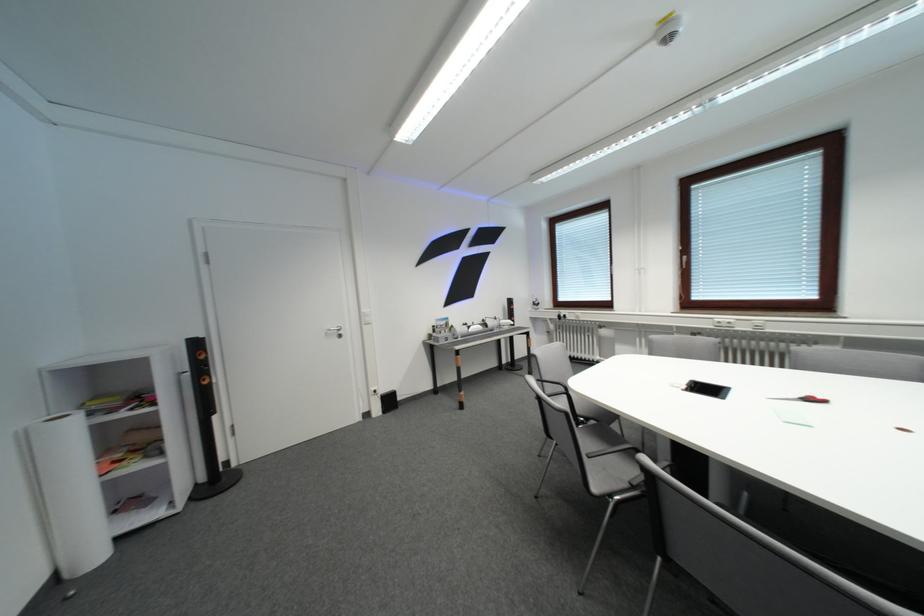
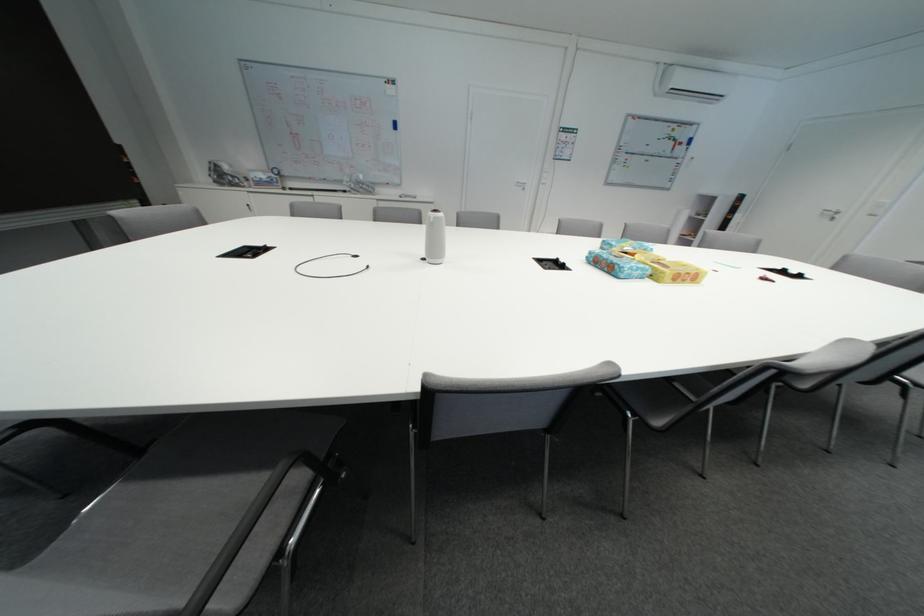
Question: I am providing you with two images of the same scene from different viewpoints. Which of the following objects are not visible in image2?

Choices:
 (A) white nunchuk controller
 (B) grey chair sitting surface
 (C) chair sitting surface
 (D) blue whiteboard eraser

Answer: (C)